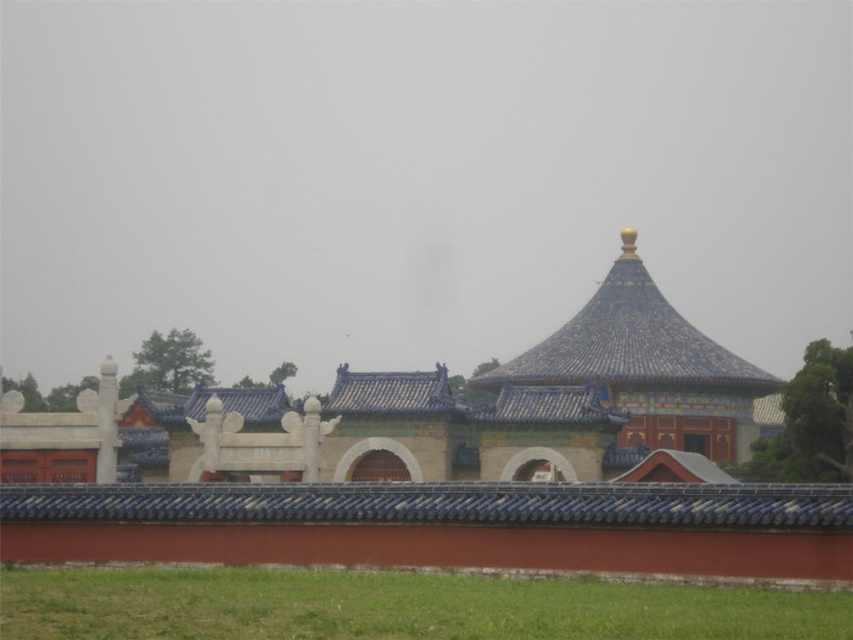
Question: Is blue glazed tiles at center closer to camera compared to blue glazed tile roof at center?

Choices:
 (A) yes
 (B) no

Answer: (A)

Question: Is blue glazed tiles at center to the left of blue glazed tile roof at center from the viewer's perspective?

Choices:
 (A) yes
 (B) no

Answer: (A)

Question: Does blue glazed tiles at center have a lesser width compared to blue glazed tile roof at center?

Choices:
 (A) no
 (B) yes

Answer: (A)

Question: Which of the following is the closest to the observer?

Choices:
 (A) blue glazed tiles at center
 (B) blue glazed tile roof at center

Answer: (A)

Question: Which of the following is the farthest from the observer?

Choices:
 (A) blue glazed tiles at center
 (B) blue glazed tile roof at center

Answer: (B)